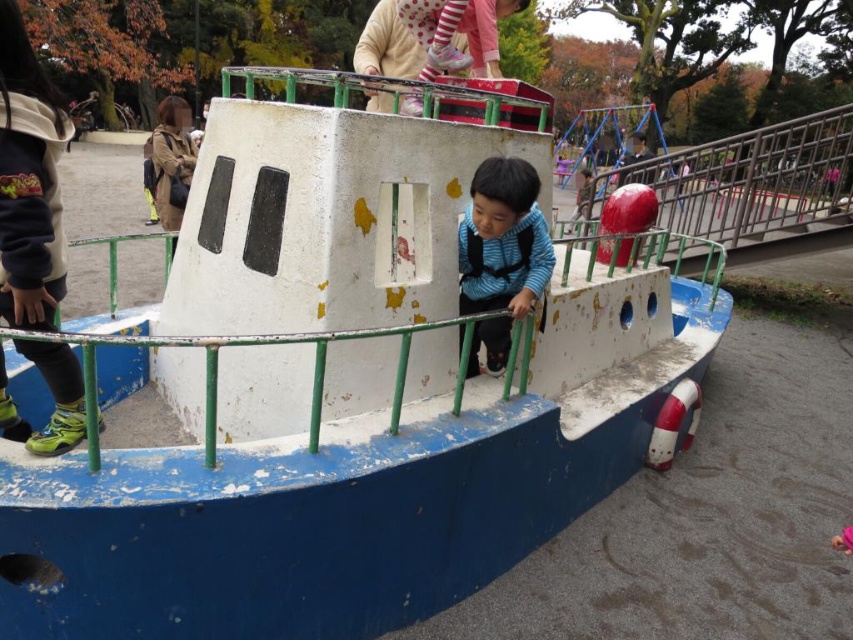
You are a parent supervising children at the playground. You notice a blue matte vest at center and a white rubber lifebuoy at lower right. Your child wants to pick up the lifebuoy but is currently holding the vest. Can they reach it without letting go of the vest?

The blue matte vest at center and white rubber lifebuoy at lower right are 1.69 meters apart. Since the distance between them is greater than an average child arm length, the child cannot reach the lifebuoy while holding the vest.